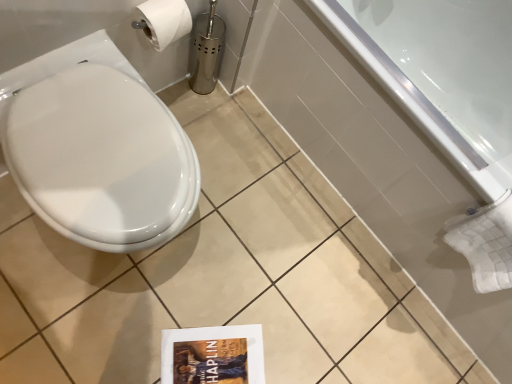
Find the location of a particular element. empty space that is ontop of white glossy toilet at left (from a real-world perspective) is located at coordinates (101, 144).